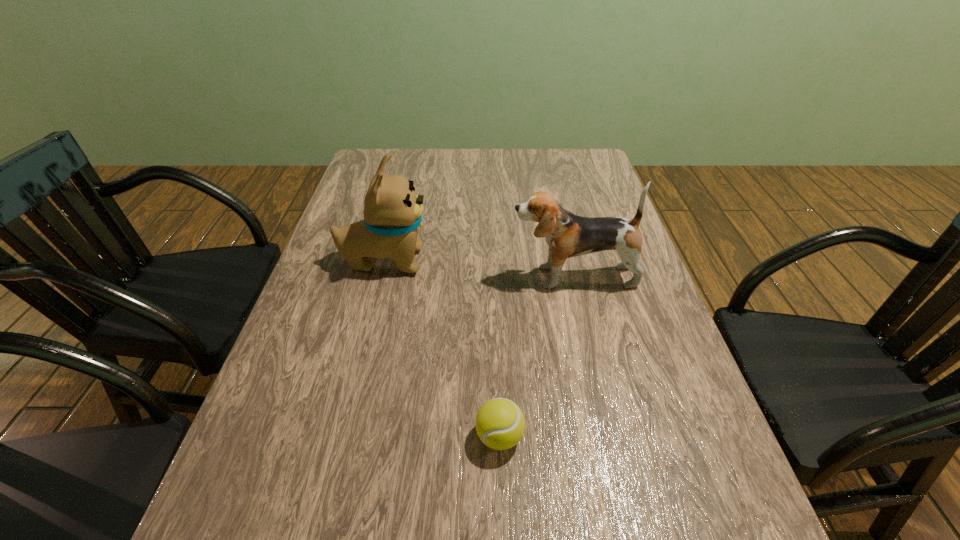
At what (x,y) coordinates should I click in order to perform the action: click on object that is at the right edge. Please return your answer as a coordinate pair (x, y). The image size is (960, 540). Looking at the image, I should click on (568, 235).

This screenshot has height=540, width=960. I want to click on vacant area at the far edge of the desktop, so click(x=509, y=157).

I want to click on vacant space at the left edge of the desktop, so click(308, 297).

Image resolution: width=960 pixels, height=540 pixels. In the image, there is a desktop. What are the coordinates of `vacant space at the right edge` in the screenshot? It's located at (709, 530).

In the image, there is a desktop. Find the location of `vacant space at the far left corner`. vacant space at the far left corner is located at coordinates (367, 155).

This screenshot has height=540, width=960. Find the location of `vacant space at the far right corner`. vacant space at the far right corner is located at coordinates (579, 161).

Where is `empty space that is in between the tennis ball and the right puppy`? Image resolution: width=960 pixels, height=540 pixels. empty space that is in between the tennis ball and the right puppy is located at coordinates (537, 356).

At what (x,y) coordinates should I click in order to perform the action: click on free spot between the left puppy and the nearest object. Please return your answer as a coordinate pair (x, y). Looking at the image, I should click on (442, 348).

I want to click on vacant space that's between the right puppy and the leftmost object, so click(479, 269).

At what (x,y) coordinates should I click in order to perform the action: click on unoccupied position between the shortest object and the leftmost object. Please return your answer as a coordinate pair (x, y). The width and height of the screenshot is (960, 540). Looking at the image, I should click on (442, 348).